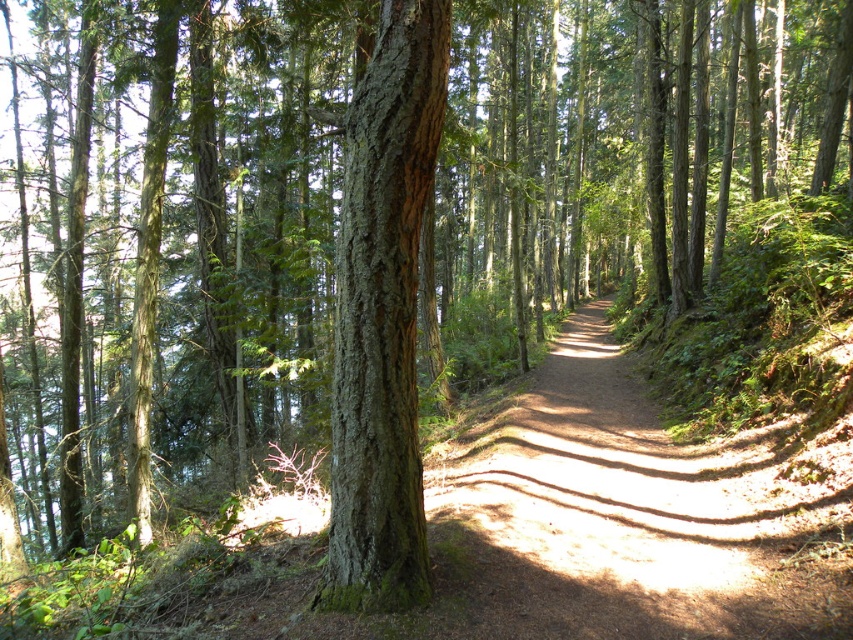
Question: Does dirt path at center appear under green rough bark tree at center?

Choices:
 (A) yes
 (B) no

Answer: (A)

Question: Does dirt path at center have a greater width compared to green rough bark tree at center?

Choices:
 (A) yes
 (B) no

Answer: (A)

Question: Among these objects, which one is farthest from the camera?

Choices:
 (A) dirt path at center
 (B) green rough bark tree at center

Answer: (B)

Question: Can you confirm if dirt path at center is positioned to the right of green rough bark tree at center?

Choices:
 (A) no
 (B) yes

Answer: (B)

Question: Which object appears farthest from the camera in this image?

Choices:
 (A) green rough bark tree at center
 (B) dirt path at center

Answer: (A)

Question: Which object is closer to the camera taking this photo?

Choices:
 (A) dirt path at center
 (B) green rough bark tree at center

Answer: (A)